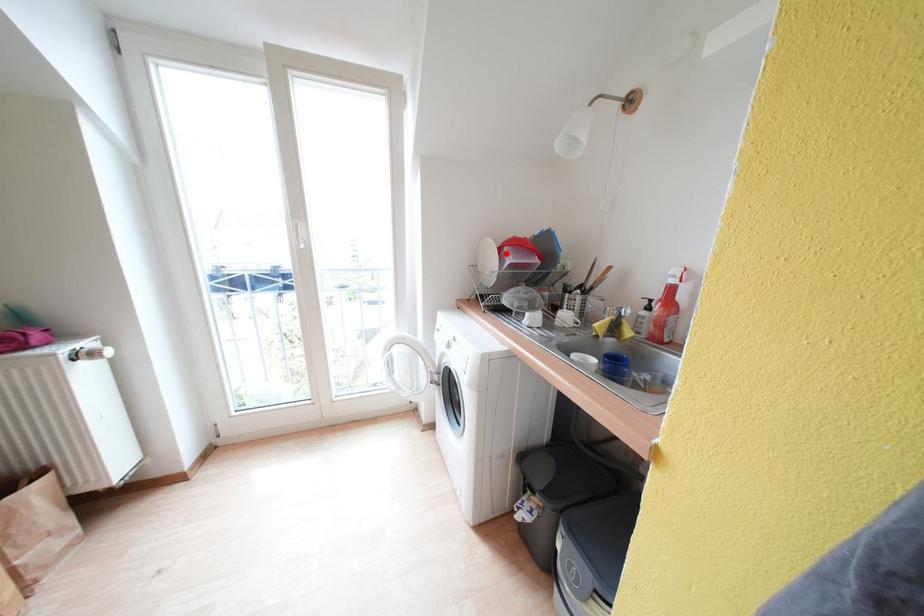
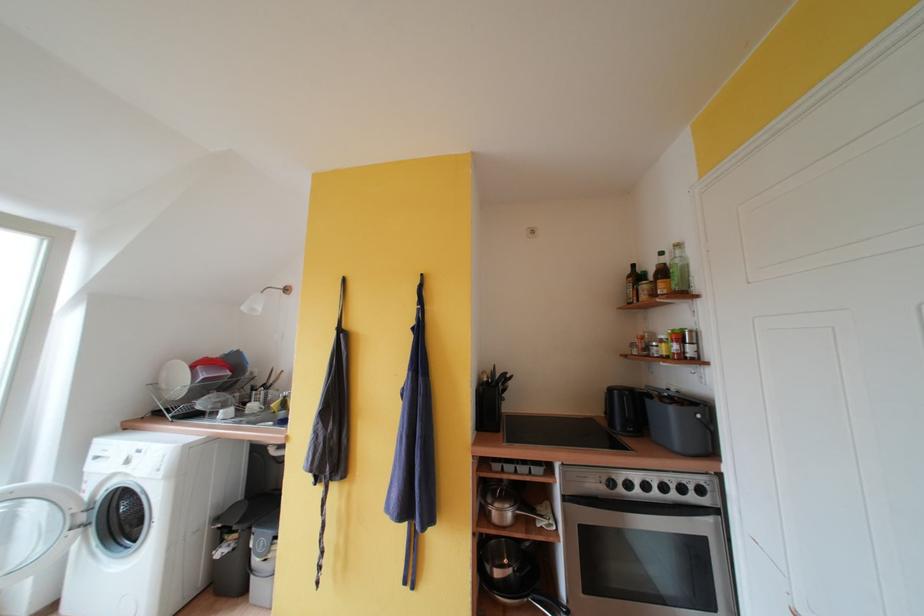
Question: I am providing you with two images of the same scene from different viewpoints. A red point is marked on the first image. Can you still see the location of the red point in image 2?

Choices:
 (A) Yes
 (B) No

Answer: (A)